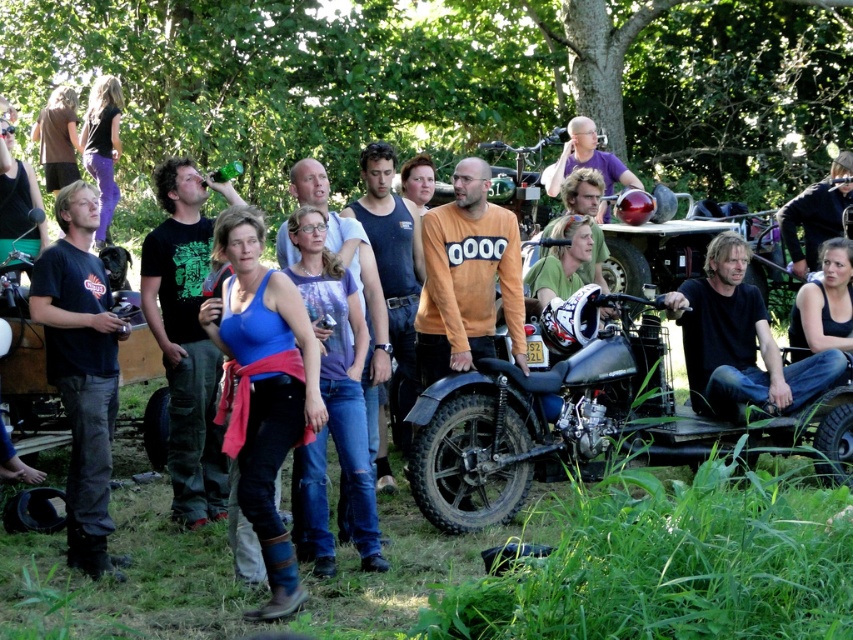
You are planning to take a photo of the matte blue tank top at center and the matte orange shirt at center from a distance. What is the minimum distance you need to stand away from both to capture them in the same frame?

The minimum distance you need to stand away from both the matte blue tank top at center and the matte orange shirt at center is 35.05 feet to capture them in the same frame.

Based on the photo, you are at the festival and want to take a photo of both the matte black motorcycle at center and the matte blue tank top at center. Since you can only focus on one object at a time, which one should you aim your camera at first to ensure both are in the frame?

The matte black motorcycle at center is located below the matte blue tank top at center, so you should focus on the matte blue tank top at center first to ensure both are in the frame.

You are a photographer trying to capture a photo of both point [251,368] and point [563,150] in the scene. Which point should you focus on first to ensure both are in sharp focus?

You should focus on point [251,368] first because it is closer to the camera than point [563,150]. By focusing on the closer point, the depth of field may extend to include the farther point, ensuring both are in focus.